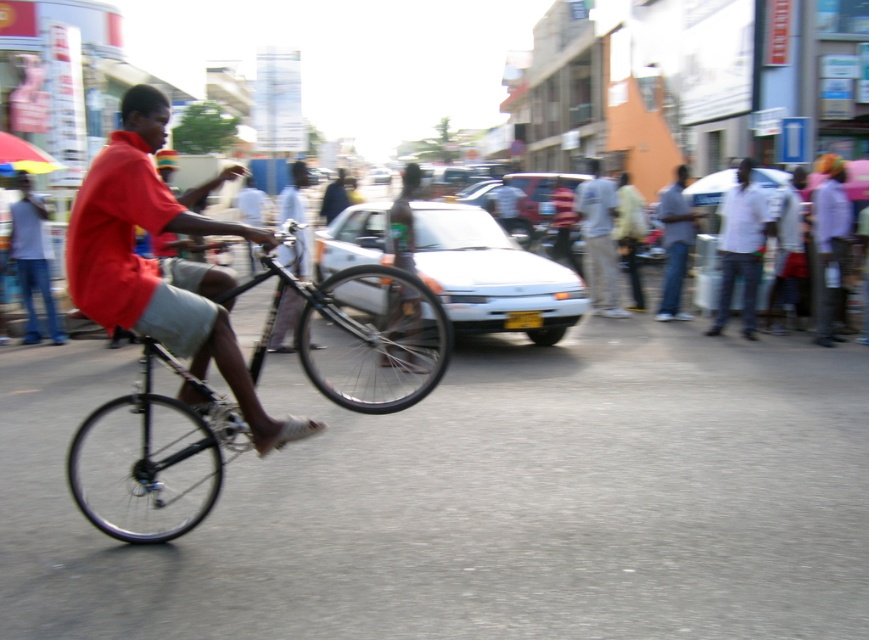
Question: Estimate the real-world distances between objects in this image. Which object is closer to the white matte shirt at right?

Choices:
 (A) light gray cotton pants at center
 (B) matte red shirt at center
 (C) denim jeans at right
 (D) white glossy car at center

Answer: (C)

Question: Based on their relative distances, which object is nearer to the white matte shirt at right?

Choices:
 (A) white glossy car at center
 (B) denim jeans at right
 (C) shiny black bicycle at center

Answer: (B)

Question: Which point is closer to the camera?

Choices:
 (A) white matte shirt at right
 (B) light gray cotton pants at center

Answer: (A)

Question: Where is shiny black bicycle at center located in relation to light gray cotton pants at center in the image?

Choices:
 (A) below
 (B) above

Answer: (A)

Question: Is shiny black bicycle at center to the right of white glossy car at center from the viewer's perspective?

Choices:
 (A) yes
 (B) no

Answer: (B)

Question: Observing the image, what is the correct spatial positioning of matte red shirt at center in reference to denim jeans at right?

Choices:
 (A) left
 (B) right

Answer: (A)